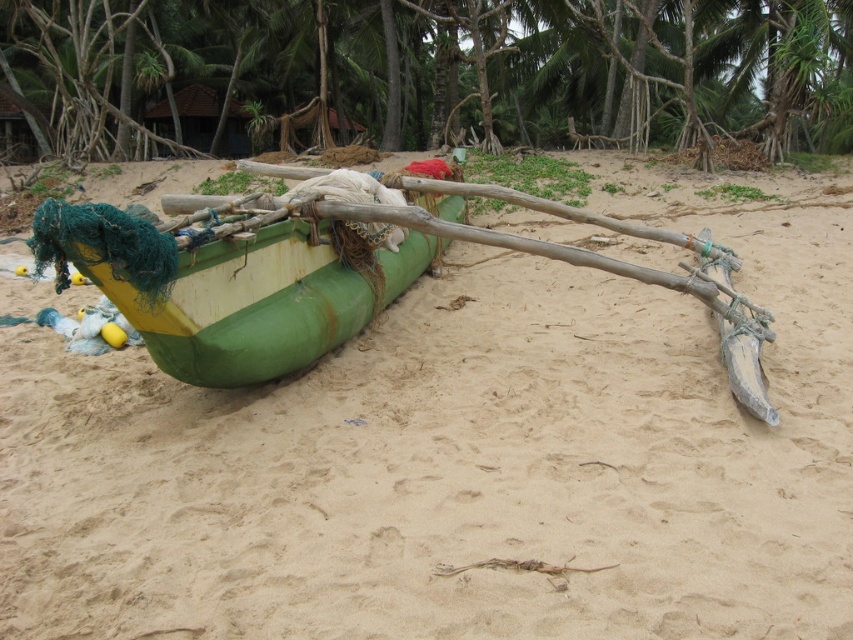
Can you confirm if green leafy tree at upper center is bigger than green rubber boat at center?

Correct, green leafy tree at upper center is larger in size than green rubber boat at center.

Between green leafy tree at upper center and green rubber boat at center, which one appears on the left side from the viewer's perspective?

green leafy tree at upper center

Image resolution: width=853 pixels, height=640 pixels. What do you see at coordinates (428, 72) in the screenshot? I see `green leafy tree at upper center` at bounding box center [428, 72].

Where is `green leafy tree at upper center`? The image size is (853, 640). green leafy tree at upper center is located at coordinates (428, 72).